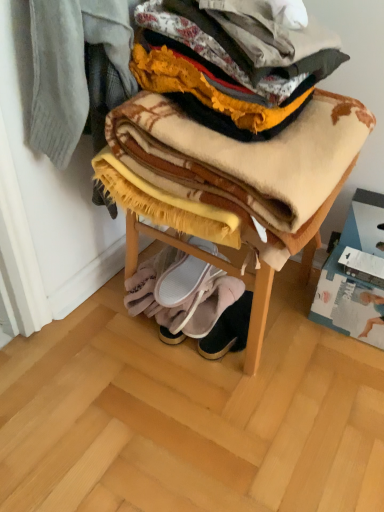
The width and height of the screenshot is (384, 512). I want to click on free space to the left of soft yellow fleece blanket at lower center, marked as the 1th blanket in a bottom-to-top arrangement, so click(x=106, y=314).